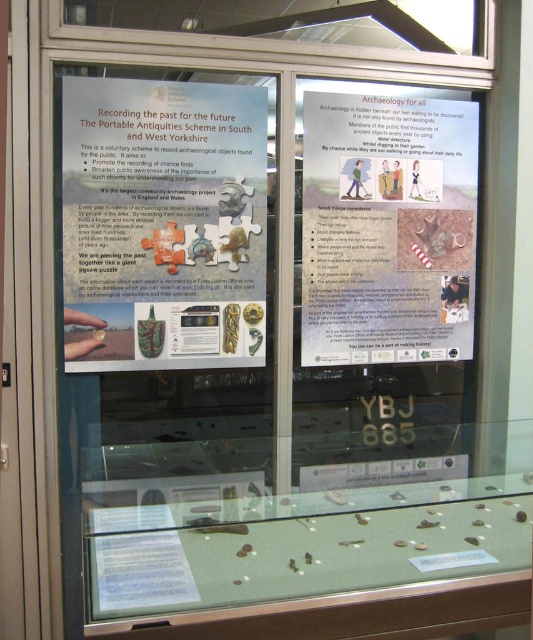
You are a visitor standing in front of the display case and want to read both the matte paper poster at center and the matte paper poster at upper right. If your arms can reach up to 22 inches, can you comfortably read both posters without moving your position?

The matte paper poster at center is 20.25 inches from the matte paper poster at upper right. Since your arms can reach up to 22 inches, you can comfortably read both posters without moving your position.

You are standing in front of the display case and want to touch the point at coordinate point (179, 326). Can you reach it without any tools?

The point at coordinate point (179, 326) is 2.13 meters away from you, so you cannot reach it without tools.

Based on the scene description, what is the spatial relationship between the matte paper poster at center and the matte paper poster at upper right?

The matte paper poster at center is to the left of the matte paper poster at upper right.